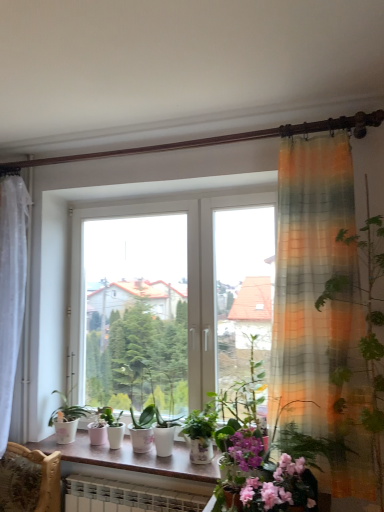
Question: From the image's perspective, does white glossy window sill at center appear lower than green matte plant at center?

Choices:
 (A) no
 (B) yes

Answer: (B)

Question: Considering the relative sizes of white glossy window sill at center and green matte plant at center in the image provided, is white glossy window sill at center shorter than green matte plant at center?

Choices:
 (A) yes
 (B) no

Answer: (A)

Question: Does white glossy window sill at center have a greater width compared to green matte plant at center?

Choices:
 (A) yes
 (B) no

Answer: (A)

Question: Does white glossy window sill at center lie behind green matte plant at center?

Choices:
 (A) no
 (B) yes

Answer: (A)

Question: Can you confirm if white glossy window sill at center is smaller than green matte plant at center?

Choices:
 (A) no
 (B) yes

Answer: (A)

Question: Considering the positions of white glossy window sill at center and pink matte flower at lower center in the image, is white glossy window sill at center wider or thinner than pink matte flower at lower center?

Choices:
 (A) wide
 (B) thin

Answer: (A)

Question: From the image's perspective, is white glossy window sill at center positioned above or below pink matte flower at lower center?

Choices:
 (A) above
 (B) below

Answer: (B)

Question: Is white glossy window sill at center inside or outside of pink matte flower at lower center?

Choices:
 (A) outside
 (B) inside

Answer: (A)

Question: Is white glossy window sill at center to the left or to the right of pink matte flower at lower center in the image?

Choices:
 (A) right
 (B) left

Answer: (B)

Question: From a real-world perspective, is pink matte flower at lower center physically located above or below white glossy window sill at center?

Choices:
 (A) below
 (B) above

Answer: (B)

Question: Is pink matte flower at lower center to the left or to the right of white glossy window sill at center in the image?

Choices:
 (A) right
 (B) left

Answer: (A)

Question: Relative to white glossy window sill at center, is pink matte flower at lower center in front or behind?

Choices:
 (A) behind
 (B) front

Answer: (B)

Question: From the image's perspective, is pink matte flower at lower center above or below white glossy window sill at center?

Choices:
 (A) below
 (B) above

Answer: (B)

Question: From a real-world perspective, relative to pink matte flower at lower center, is green matte plant at center vertically above or below?

Choices:
 (A) below
 (B) above

Answer: (B)

Question: Looking at their shapes, would you say green matte plant at center is wider or thinner than pink matte flower at lower center?

Choices:
 (A) wide
 (B) thin

Answer: (B)